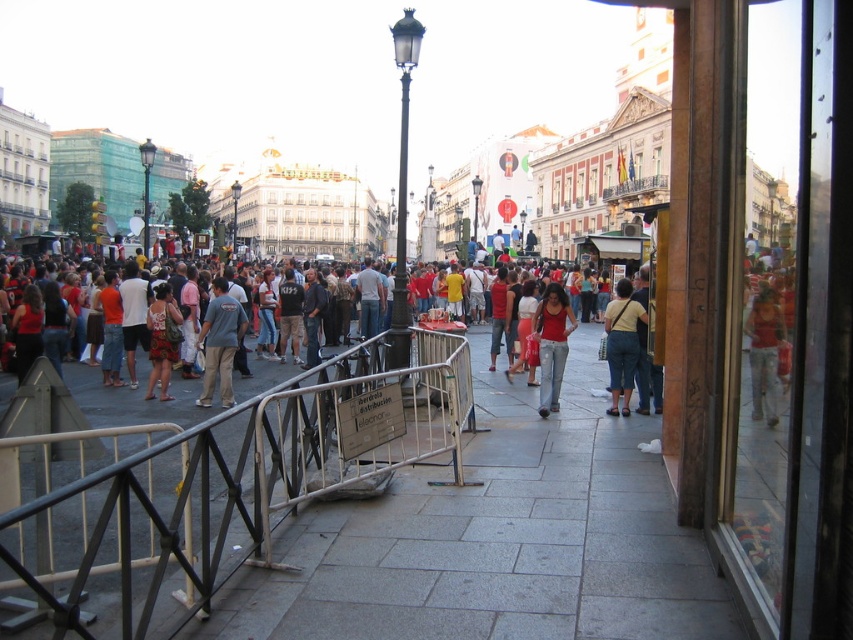
You are a delivery person trying to navigate through the city square to deliver a package. You need to go around the silver metallic rail at center. Where should you position yourself relative to the rail to avoid it?

The silver metallic rail at center is located at point (229, 488), so you should position yourself either to the left or right of the rail to avoid it.

You are a delivery person trying to navigate through the city square. You need to place a large package on the gray concrete pavement at center. To do so, you must first move around the silver metallic rail at center. Which direction should you move relative to the rail to reach the pavement?

The gray concrete pavement at center is positioned on the right side of the silver metallic rail at center, so you should move to the right side of the silver metallic rail at center to reach the gray concrete pavement at center.

You are a delivery person who needs to deliver a package to a person wearing denim jeans at right. The package is too large to carry while walking through the crowd. You decide to place it on the silver metallic rail at center. Is the rail close enough to the jeans to make this feasible?

The silver metallic rail at center is 78.70 feet from denim jeans at right. Since 78.70 feet is a considerable distance, placing the package on the rail would not be feasible as it is too far from the denim jeans at right.